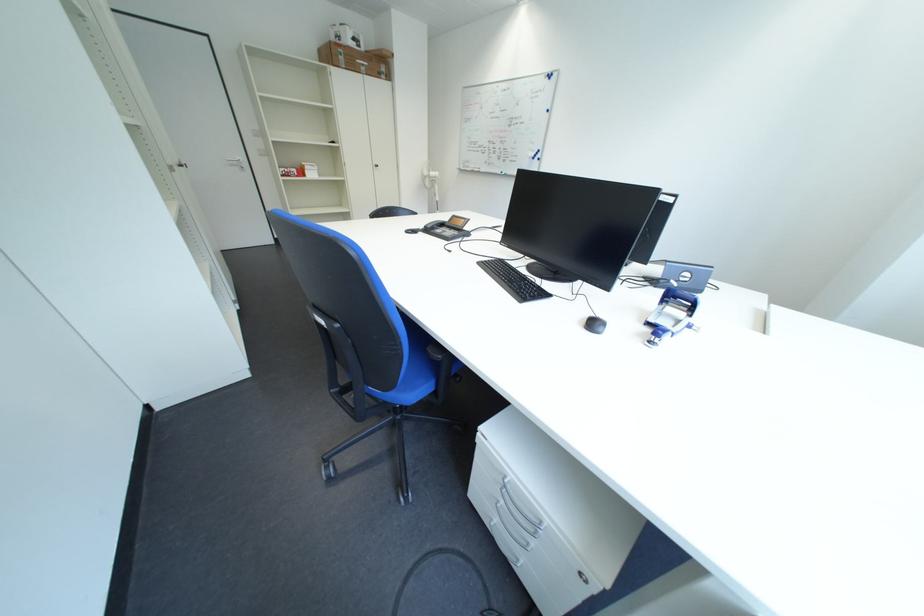
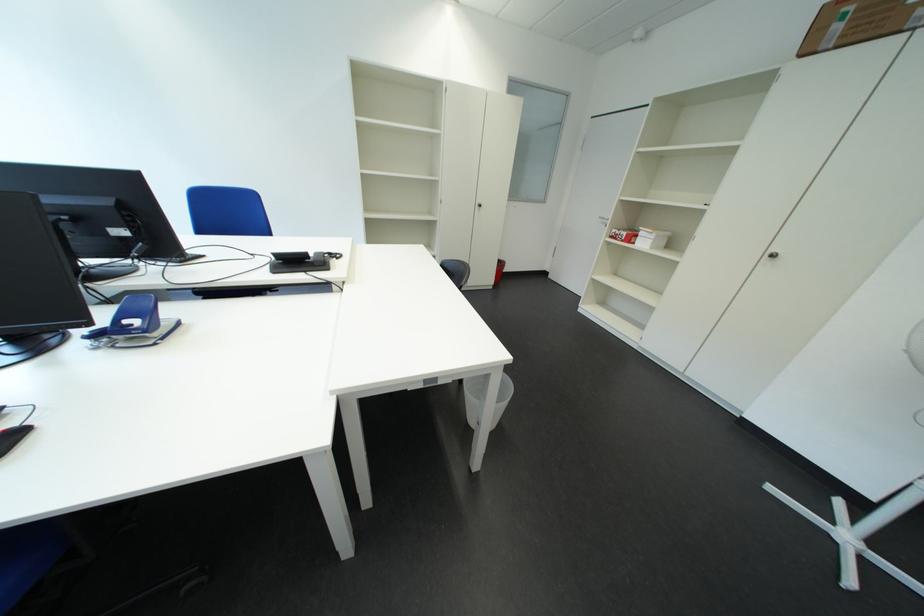
Where in the second image is the point corresponding to (354,61) from the first image?

(849, 30)